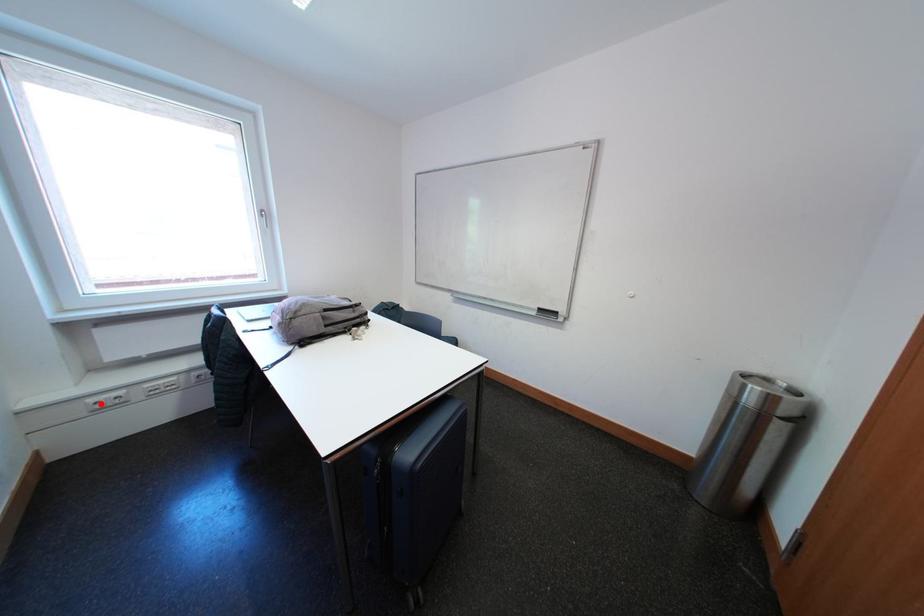
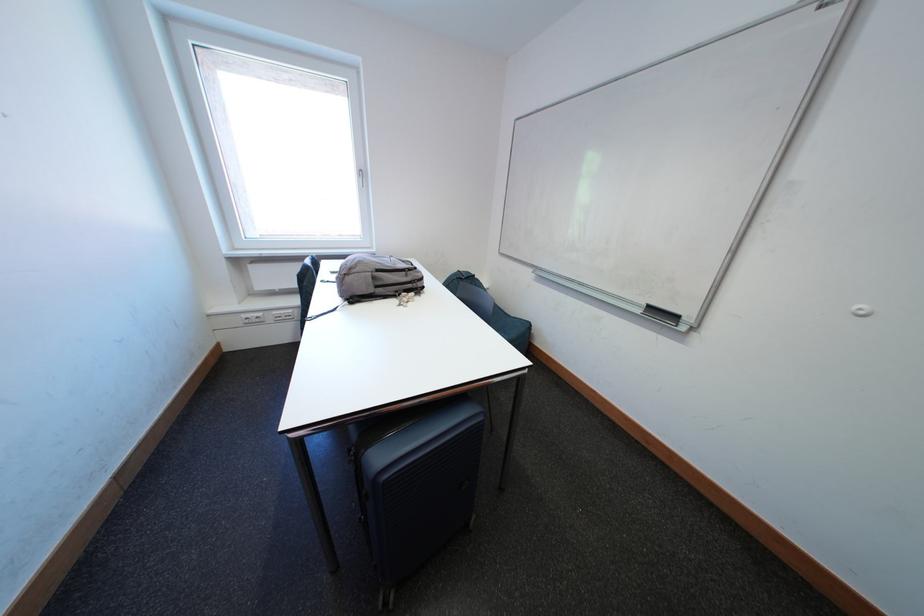
Where in the second image is the point corresponding to the highlighted location from the first image?

(253, 320)